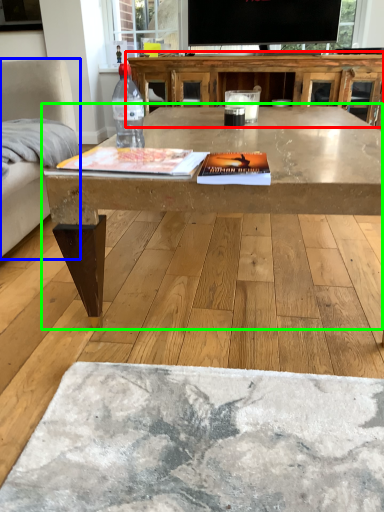
Question: Based on their relative distances, which object is nearer to table (highlighted by a red box)? Choose from armchair (highlighted by a blue box) and coffee table (highlighted by a green box).

Choices:
 (A) armchair
 (B) coffee table

Answer: (B)